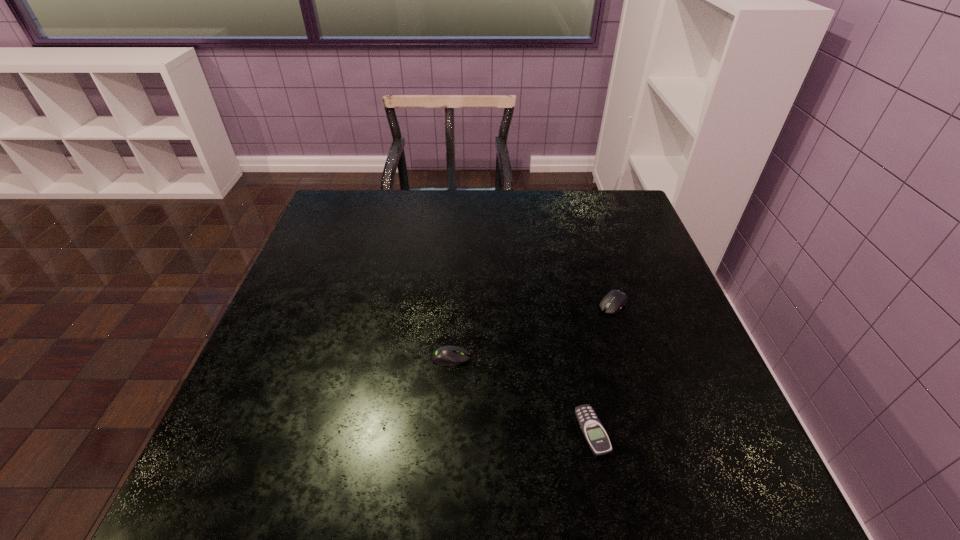
You are a GUI agent. You are given a task and a screenshot of the screen. Output one action in this format:
    pyautogui.click(x=<x>, y=<y>)
    Task: Click on the object that is at the right edge
    The height and width of the screenshot is (540, 960).
    Given the screenshot: What is the action you would take?
    pyautogui.click(x=614, y=300)

Locate an element on the screen. This screenshot has height=540, width=960. vacant region at the far edge of the desktop is located at coordinates (551, 229).

Find the location of a particular element. The width and height of the screenshot is (960, 540). vacant region at the near edge is located at coordinates [457, 491].

Where is `vacant space at the left edge of the desktop`? vacant space at the left edge of the desktop is located at coordinates (333, 340).

Locate an element on the screen. This screenshot has width=960, height=540. blank area at the right edge is located at coordinates (658, 255).

Where is `vacant region at the far left corner of the desktop`? vacant region at the far left corner of the desktop is located at coordinates (318, 233).

At what (x,y) coordinates should I click in order to perform the action: click on vacant space at the far right corner of the desktop. Please return your answer as a coordinate pair (x, y). Looking at the image, I should click on (600, 192).

In the image, there is a desktop. Where is `vacant space at the near right corner`? Image resolution: width=960 pixels, height=540 pixels. vacant space at the near right corner is located at coordinates (727, 469).

Locate an element on the screen. vacant space that is in between the right computer mouse and the second object from right to left is located at coordinates (603, 368).

This screenshot has height=540, width=960. In order to click on vacant point located between the leftmost object and the farther computer mouse in this screenshot , I will do `click(532, 331)`.